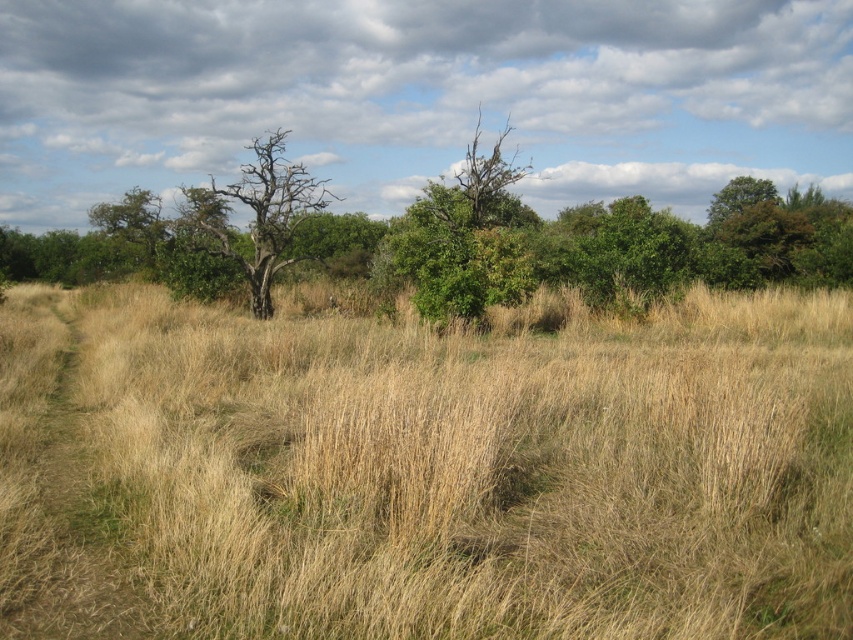
Is dry grass at center behind green leafy tree at center?

That is False.

Does dry grass at center have a lesser height compared to green leafy tree at center?

Correct, dry grass at center is not as tall as green leafy tree at center.

Between point (390, 524) and point (444, 211), which one is positioned behind?

The point (444, 211) is behind.

Where is `dry grass at center`? The width and height of the screenshot is (853, 640). dry grass at center is located at coordinates (425, 470).

Is green leafy tree at center further to camera compared to bare wood tree at center?

No, green leafy tree at center is in front of bare wood tree at center.

Who is more distant from viewer, (577, 214) or (265, 310)?

The point (577, 214) is behind.

The width and height of the screenshot is (853, 640). In order to click on green leafy tree at center in this screenshot , I will do `click(444, 240)`.

Does dry grass at center have a lesser width compared to bare wood tree at center?

Correct, dry grass at center's width is less than bare wood tree at center's.

Between point (33, 445) and point (268, 289), which one is positioned in front?

Point (33, 445) is more forward.

This screenshot has height=640, width=853. I want to click on dry grass at center, so click(x=425, y=470).